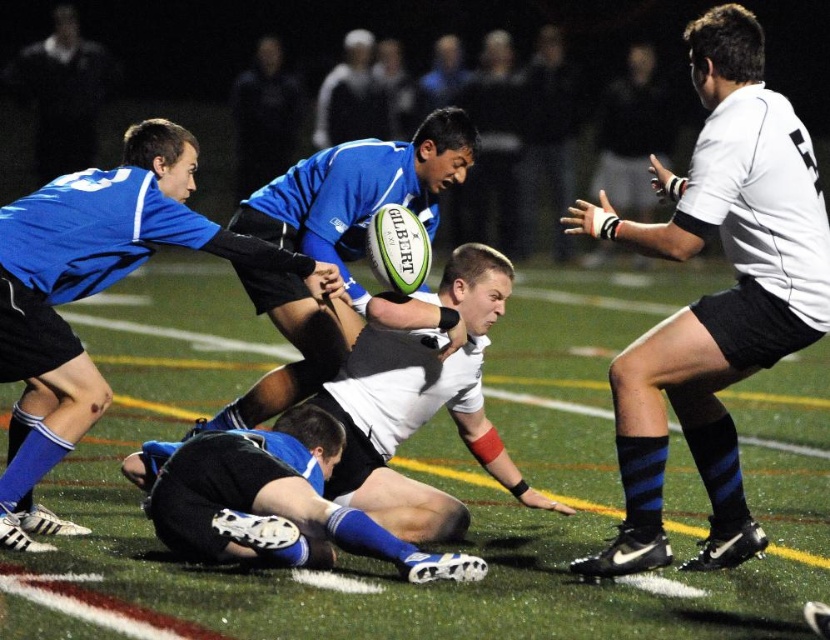
You are a rugby coach analyzing the scrum formation. You notice two key points marked on the field at coordinates point (91, 404) and point (72, 115). Based on the image, which point is positioned closer to your vantage point as you observe the match from the sidelines?

Point (91, 404) is closer to the viewer than point (72, 115).